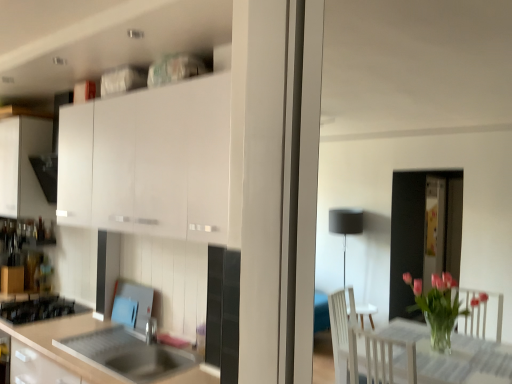
Question: Is matte white cabinet at left, arranged as the 2th cabinetry when viewed from the front, further to the viewer compared to stainless steel sink at lower left?

Choices:
 (A) yes
 (B) no

Answer: (A)

Question: Is matte white cabinet at left, arranged as the 2th cabinetry when viewed from the front, positioned in front of stainless steel sink at lower left?

Choices:
 (A) no
 (B) yes

Answer: (A)

Question: Considering the relative sizes of matte white cabinet at left, arranged as the 2th cabinetry when viewed from the front, and stainless steel sink at lower left in the image provided, is matte white cabinet at left, arranged as the 2th cabinetry when viewed from the front, smaller than stainless steel sink at lower left?

Choices:
 (A) no
 (B) yes

Answer: (A)

Question: Is matte white cabinet at left, placed as the first cabinetry when sorted from left to right, thinner than stainless steel sink at lower left?

Choices:
 (A) no
 (B) yes

Answer: (A)

Question: Is matte white cabinet at left, placed as the first cabinetry when sorted from left to right, facing away from stainless steel sink at lower left?

Choices:
 (A) no
 (B) yes

Answer: (A)

Question: Is matte white cabinet at left, arranged as the 2th cabinetry when viewed from the front, to the right of stainless steel sink at lower left from the viewer's perspective?

Choices:
 (A) no
 (B) yes

Answer: (A)

Question: Is white matte cabinet at upper left, placed as the first cabinetry when sorted from right to left, to the left of stainless steel sink at lower left from the viewer's perspective?

Choices:
 (A) yes
 (B) no

Answer: (B)

Question: Can you confirm if white matte cabinet at upper left, placed as the 2th cabinetry when sorted from back to front, is thinner than stainless steel sink at lower left?

Choices:
 (A) yes
 (B) no

Answer: (A)

Question: Could you tell me if white matte cabinet at upper left, placed as the 2th cabinetry when sorted from back to front, is facing stainless steel sink at lower left?

Choices:
 (A) yes
 (B) no

Answer: (B)

Question: Can you see white matte cabinet at upper left, placed as the first cabinetry when sorted from right to left, touching stainless steel sink at lower left?

Choices:
 (A) yes
 (B) no

Answer: (B)

Question: From the image's perspective, is white matte cabinet at upper left, which ranks as the first cabinetry in front-to-back order, located above stainless steel sink at lower left?

Choices:
 (A) no
 (B) yes

Answer: (B)

Question: Is white matte cabinet at upper left, which ranks as the first cabinetry in front-to-back order, located outside stainless steel sink at lower left?

Choices:
 (A) no
 (B) yes

Answer: (B)

Question: Is matte white cabinet at left, the first cabinetry from the back, oriented away from white matte cabinet at upper left, which ranks as the first cabinetry in front-to-back order?

Choices:
 (A) no
 (B) yes

Answer: (A)